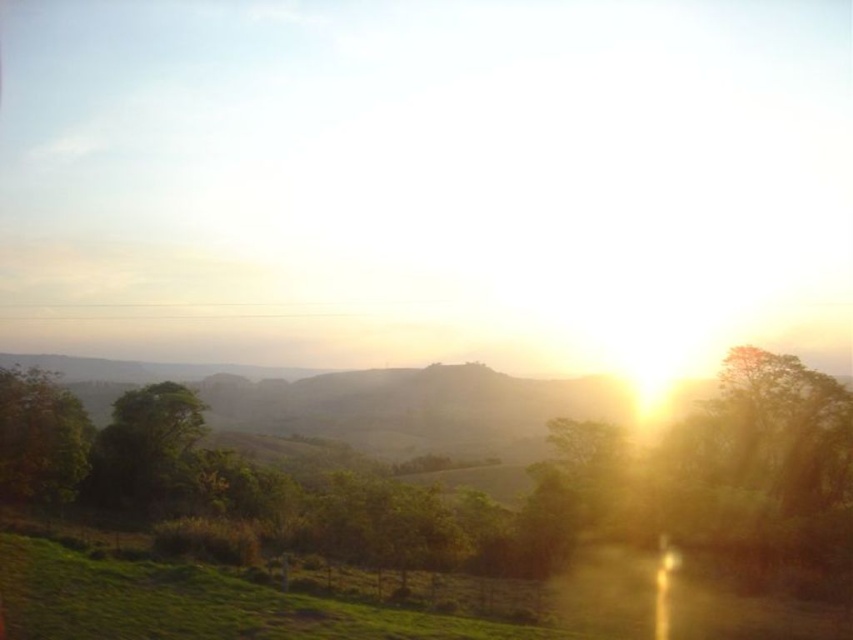
The height and width of the screenshot is (640, 853). I want to click on green leafy tree at left, so click(144, 449).

Is green leafy tree at left wider than green matte tree at left?

No, green leafy tree at left is not wider than green matte tree at left.

Find the location of `green leafy tree at left`. green leafy tree at left is located at coordinates (x=144, y=449).

At what (x,y) coordinates should I click in order to perform the action: click on green leafy tree at left. Please return your answer as a coordinate pair (x, y). The image size is (853, 640). Looking at the image, I should click on tap(144, 449).